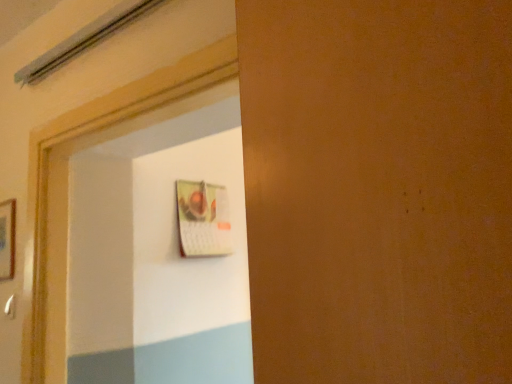
Describe the element at coordinates (10, 307) in the screenshot. I see `white plastic door handle at lower left` at that location.

Locate an element on the screen. The width and height of the screenshot is (512, 384). white plastic door handle at lower left is located at coordinates (10, 307).

Find the location of a particular element. The width and height of the screenshot is (512, 384). wooden picture frame at left is located at coordinates (7, 239).

What is the approximate width of wooden picture frame at left?

2.20 centimeters.

What do you see at coordinates (7, 239) in the screenshot? This screenshot has height=384, width=512. I see `wooden picture frame at left` at bounding box center [7, 239].

Identify the location of white plastic door handle at lower left. The width and height of the screenshot is (512, 384). coord(10,307).

Can you confirm if white plastic door handle at lower left is positioned to the right of wooden picture frame at left?

Indeed, white plastic door handle at lower left is positioned on the right side of wooden picture frame at left.

Considering the positions of objects white plastic door handle at lower left and wooden picture frame at left in the image provided, who is behind, white plastic door handle at lower left or wooden picture frame at left?

wooden picture frame at left is more distant.

Between point (14, 295) and point (14, 225), which one is positioned behind?

Positioned behind is point (14, 225).

From the image's perspective, does white plastic door handle at lower left appear higher than wooden picture frame at left?

Incorrect, from the image's perspective, white plastic door handle at lower left is lower than wooden picture frame at left.

From a real-world perspective, is white plastic door handle at lower left physically located above or below wooden picture frame at left?

Clearly, from a real-world perspective, white plastic door handle at lower left is below wooden picture frame at left.

Does white plastic door handle at lower left have a greater width compared to wooden picture frame at left?

No.

From their relative heights in the image, would you say white plastic door handle at lower left is taller or shorter than wooden picture frame at left?

In the image, white plastic door handle at lower left appears to be shorter than wooden picture frame at left.

Can you confirm if white plastic door handle at lower left is bigger than wooden picture frame at left?

No, white plastic door handle at lower left is not bigger than wooden picture frame at left.

Looking at this image, is wooden picture frame at left surrounded by white plastic door handle at lower left?

No, wooden picture frame at left is not surrounded by white plastic door handle at lower left.

Is white plastic door handle at lower left positioned far away from wooden picture frame at left?

Actually, white plastic door handle at lower left and wooden picture frame at left are a little close together.

Is white plastic door handle at lower left oriented away from wooden picture frame at left?

No, white plastic door handle at lower left is not facing the opposite direction of wooden picture frame at left.

What's the angular difference between white plastic door handle at lower left and wooden picture frame at left's facing directions?

0.88 degrees.

Measure the distance from white plastic door handle at lower left to wooden picture frame at left.

white plastic door handle at lower left is 6.70 inches away from wooden picture frame at left.

In the image, there is a white plastic door handle at lower left. At what (x,y) coordinates should I click in order to perform the action: click on picture frame above it (from the image's perspective). Please return your answer as a coordinate pair (x, y). Looking at the image, I should click on (7, 239).

In the scene shown: Considering the relative positions of wooden picture frame at left and white plastic door handle at lower left in the image provided, is wooden picture frame at left to the left of white plastic door handle at lower left from the viewer's perspective?

Indeed, wooden picture frame at left is positioned on the left side of white plastic door handle at lower left.

Is the position of wooden picture frame at left more distant than that of white plastic door handle at lower left?

Yes.

Does point (12, 219) appear closer or farther from the camera than point (13, 316)?

Point (12, 219) appears to be farther away from the viewer than point (13, 316).

From the image's perspective, which is above, wooden picture frame at left or white plastic door handle at lower left?

wooden picture frame at left, from the image's perspective.

From a real-world perspective, is wooden picture frame at left physically below white plastic door handle at lower left?

Incorrect, from a real-world perspective, wooden picture frame at left is higher than white plastic door handle at lower left.

Does wooden picture frame at left have a greater width compared to white plastic door handle at lower left?

Yes, wooden picture frame at left is wider than white plastic door handle at lower left.

Considering the relative sizes of wooden picture frame at left and white plastic door handle at lower left in the image provided, is wooden picture frame at left shorter than white plastic door handle at lower left?

Incorrect, the height of wooden picture frame at left does not fall short of that of white plastic door handle at lower left.

Who is smaller, wooden picture frame at left or white plastic door handle at lower left?

white plastic door handle at lower left is smaller.

Is wooden picture frame at left inside the boundaries of white plastic door handle at lower left, or outside?

wooden picture frame at left lies outside white plastic door handle at lower left.

Is there a large distance between wooden picture frame at left and white plastic door handle at lower left?

That's not correct — wooden picture frame at left is a little close to white plastic door handle at lower left.

Could you tell me if wooden picture frame at left is turned towards white plastic door handle at lower left?

No, wooden picture frame at left is not turned towards white plastic door handle at lower left.

How different are the orientations of wooden picture frame at left and white plastic door handle at lower left in degrees?

0.88 degrees.

Identify the location of door handle on the right of wooden picture frame at left. (10, 307).

At what (x,y) coordinates should I click in order to perform the action: click on picture frame on the left of white plastic door handle at lower left. Please return your answer as a coordinate pair (x, y). Image resolution: width=512 pixels, height=384 pixels. Looking at the image, I should click on pyautogui.click(x=7, y=239).

Find the location of `picture frame above the white plastic door handle at lower left (from a real-world perspective)`. picture frame above the white plastic door handle at lower left (from a real-world perspective) is located at coordinates 7,239.